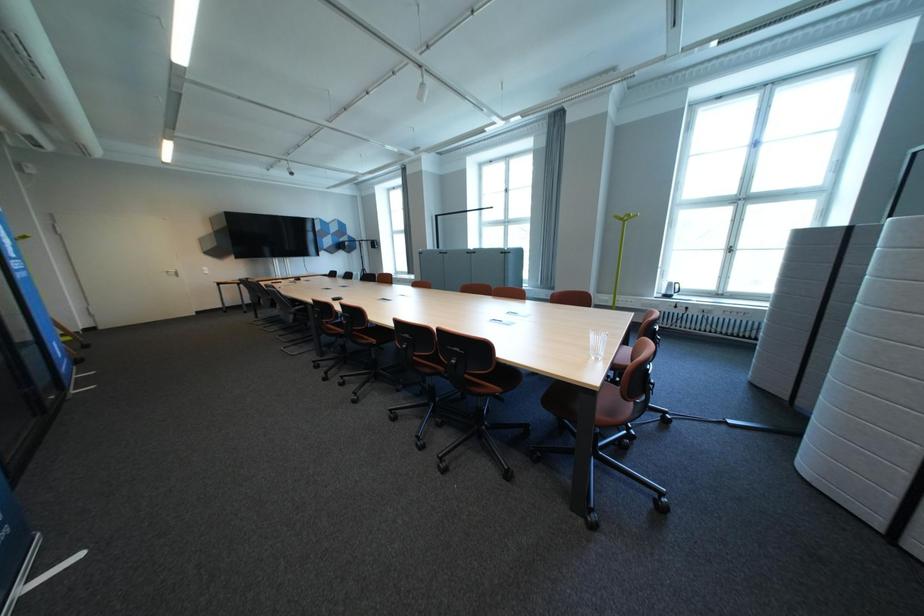
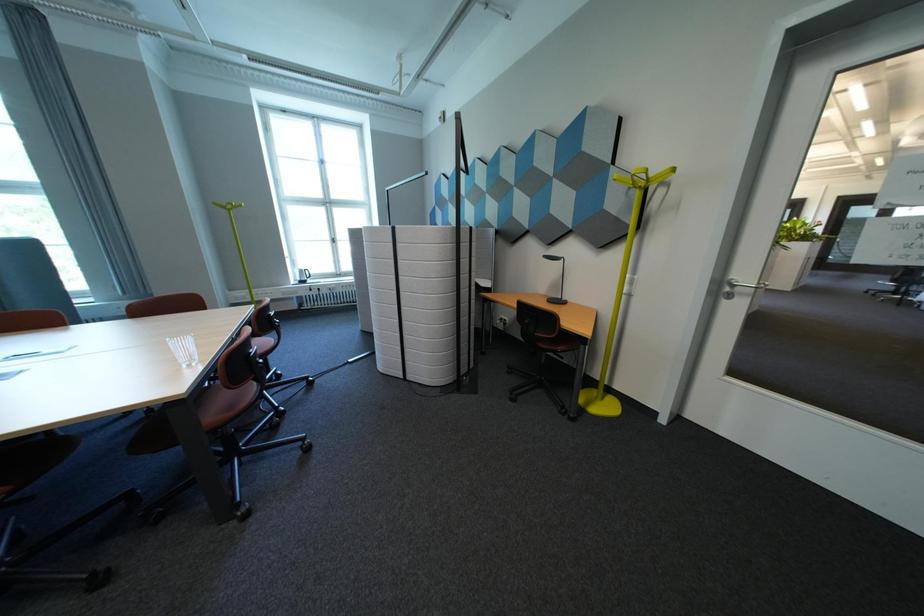
Question: Based on the continuous images, in which direction is the camera rotating? Reply with the corresponding letter.

Choices:
 (A) Left
 (B) Right
 (C) Up
 (D) Down

Answer: (B)